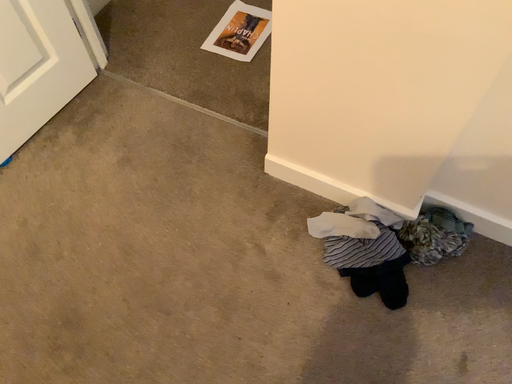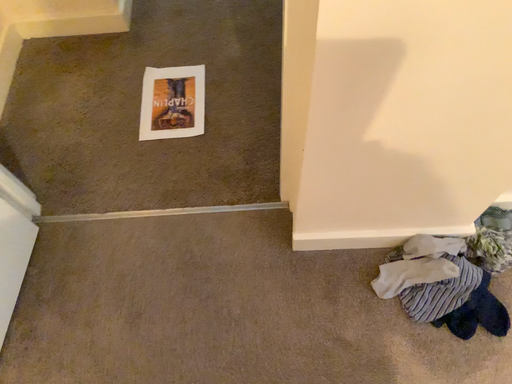
Question: How did the camera likely rotate when shooting the video?

Choices:
 (A) rotated left
 (B) rotated right

Answer: (B)